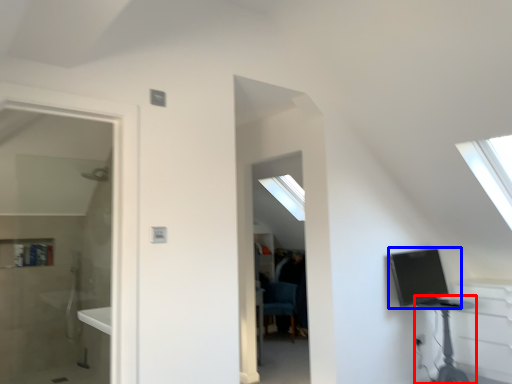
Question: Among these objects, which one is nearest to the camera, table (highlighted by a red box) or computer (highlighted by a blue box)?

Choices:
 (A) table
 (B) computer

Answer: (A)